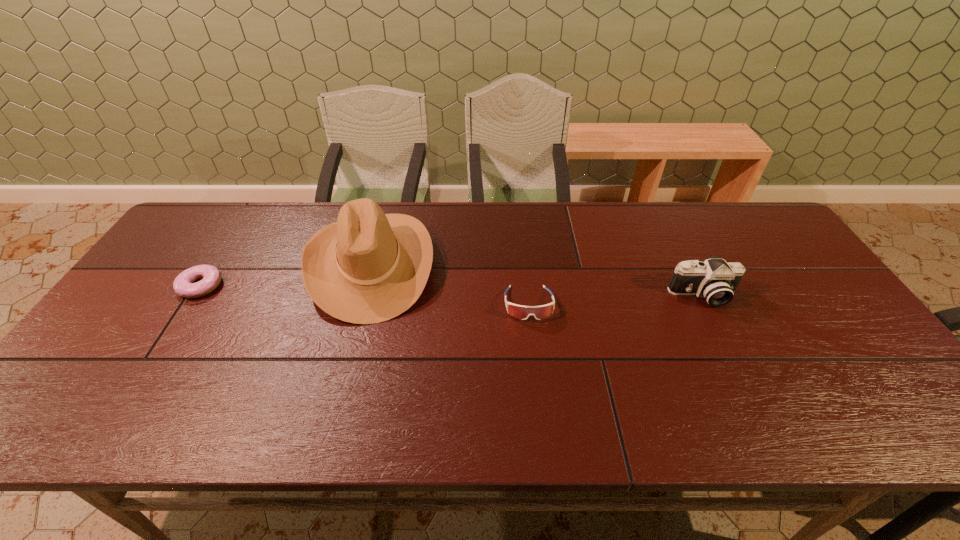
This screenshot has width=960, height=540. In order to click on free space located on the front-facing side of the third object from left to right in this screenshot , I will do `click(536, 373)`.

Identify the location of vacant position located on the front of the shortest object. (x=174, y=327).

The width and height of the screenshot is (960, 540). Find the location of `object present at the far edge`. object present at the far edge is located at coordinates (368, 267).

The width and height of the screenshot is (960, 540). What are the coordinates of `object located at the left edge` in the screenshot? It's located at (184, 286).

At what (x,y) coordinates should I click in order to perform the action: click on free spot at the far edge of the desktop. Please return your answer as a coordinate pair (x, y). Looking at the image, I should click on (504, 209).

The width and height of the screenshot is (960, 540). I want to click on vacant space at the near edge of the desktop, so click(x=496, y=402).

In the image, there is a desktop. Identify the location of free space at the right edge. The width and height of the screenshot is (960, 540). (771, 265).

Find the location of a particular element. The image size is (960, 540). vacant region at the far right corner of the desktop is located at coordinates (764, 220).

Locate an element on the screen. This screenshot has height=540, width=960. blank region between the tallest object and the rightmost object is located at coordinates (537, 279).

The image size is (960, 540). Find the location of `vacant space in between the leftmost object and the tallest object`. vacant space in between the leftmost object and the tallest object is located at coordinates (286, 274).